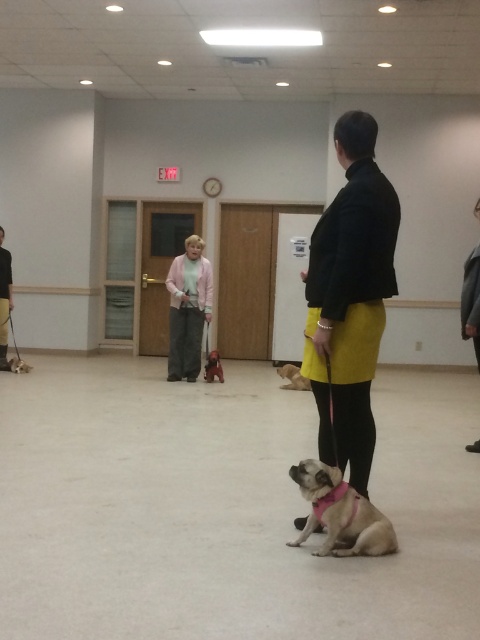
You are a photographer trying to capture both the pink fabric dog at center and the shiny black dog at center in the same frame. Based on their sizes, which dog should you move closer to the camera to ensure both appear equally sized in the photo?

Since the pink fabric dog at center is larger than the shiny black dog at center, you should move the shiny black dog at center closer to the camera. This adjustment will make both dogs appear similar in size in the photo.